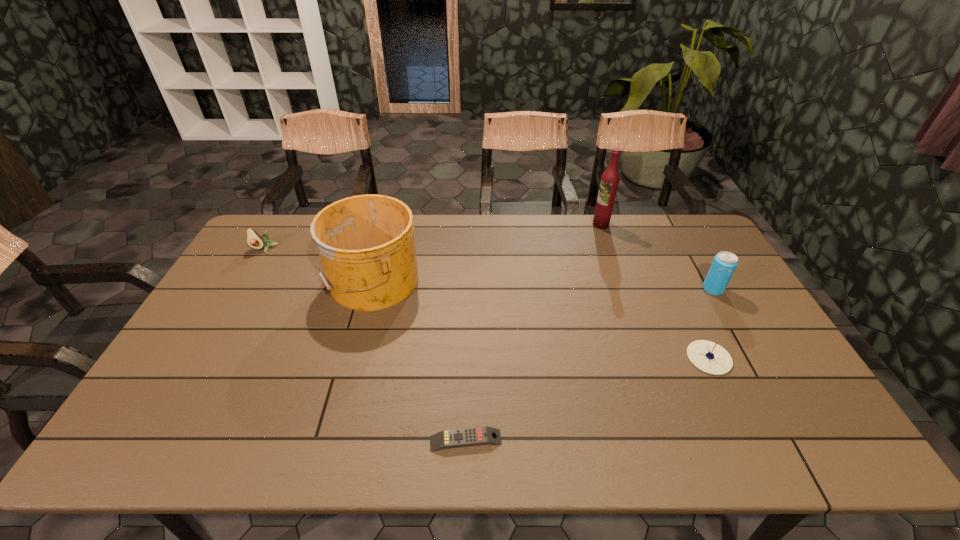
The width and height of the screenshot is (960, 540). In order to click on liquor in this screenshot , I will do `click(609, 183)`.

The width and height of the screenshot is (960, 540). In order to click on the farthest object in this screenshot , I will do `click(609, 183)`.

What are the coordinates of `the second tallest object` in the screenshot? It's located at (366, 245).

This screenshot has width=960, height=540. I want to click on the fifth object from right to left, so click(x=366, y=245).

Find the location of a particular element. The height and width of the screenshot is (540, 960). the rightmost object is located at coordinates (724, 264).

You are a GUI agent. You are given a task and a screenshot of the screen. Output one action in this format:
    pyautogui.click(x=<x>, y=<y>)
    Task: Click on the fourth shortest object
    This screenshot has width=960, height=540.
    Given the screenshot: What is the action you would take?
    pyautogui.click(x=724, y=264)

At what (x,y) coordinates should I click in order to perform the action: click on avocado. Please return your answer as a coordinate pair (x, y). The width and height of the screenshot is (960, 540). Looking at the image, I should click on (254, 240).

Find the location of a particular element. This screenshot has height=540, width=960. the leftmost object is located at coordinates (254, 240).

This screenshot has height=540, width=960. Identify the location of the fifth tallest object. (710, 357).

Image resolution: width=960 pixels, height=540 pixels. Find the location of `the second object from right to left`. the second object from right to left is located at coordinates (710, 357).